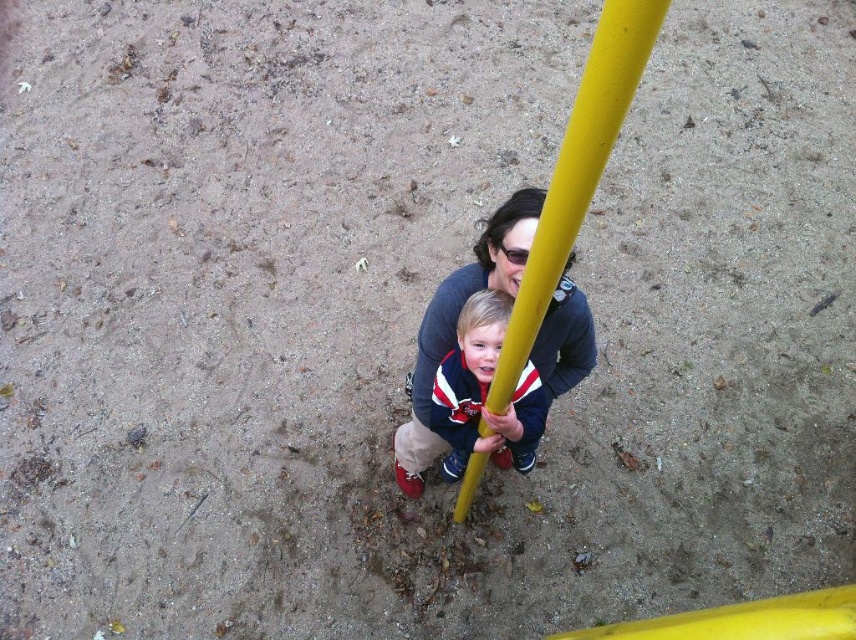
Does point (587, 160) come closer to viewer compared to point (465, 314)?

Yes, it is in front of point (465, 314).

The height and width of the screenshot is (640, 856). What are the coordinates of `yellow matte pole at center` in the screenshot? It's located at (578, 170).

Find the location of a particular element. yellow matte pole at center is located at coordinates pos(578,170).

Is matte blue sweater at center smaller than matte blue jacket at center?

No.

Locate an element on the screen. The image size is (856, 640). matte blue sweater at center is located at coordinates (455, 323).

Is yellow matte pole at center to the left of matte blue sweater at center from the viewer's perspective?

Yes, yellow matte pole at center is to the left of matte blue sweater at center.

Between point (632, 93) and point (539, 342), which one is positioned behind?

Point (539, 342)

At what (x,y) coordinates should I click in order to perform the action: click on yellow matte pole at center. Please return your answer as a coordinate pair (x, y). Looking at the image, I should click on (578, 170).